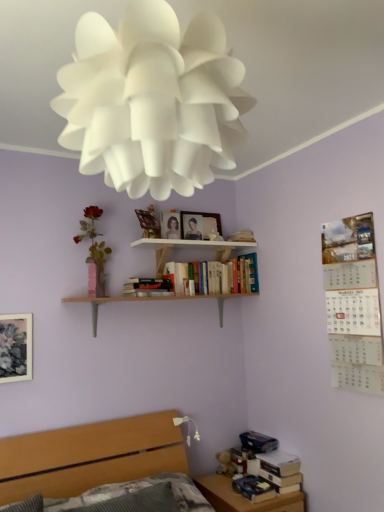
The height and width of the screenshot is (512, 384). I want to click on free spot in front of matte wooden picture frame at upper center, placed as the first picture frame when sorted from back to front, so click(x=199, y=246).